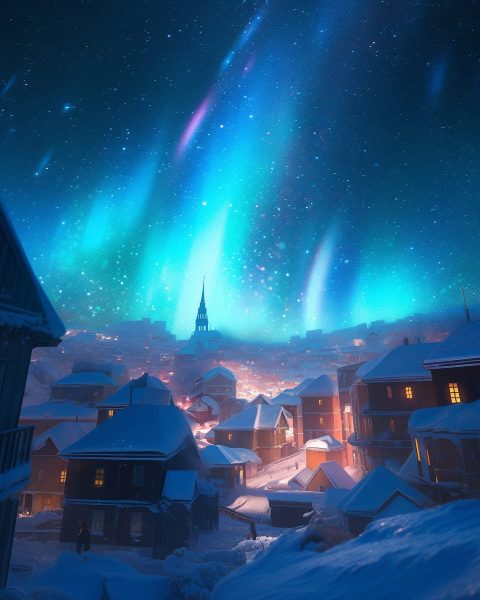
Where is `door`? This screenshot has width=480, height=600. door is located at coordinates (97, 525), (127, 528), (285, 448), (238, 471), (28, 505).